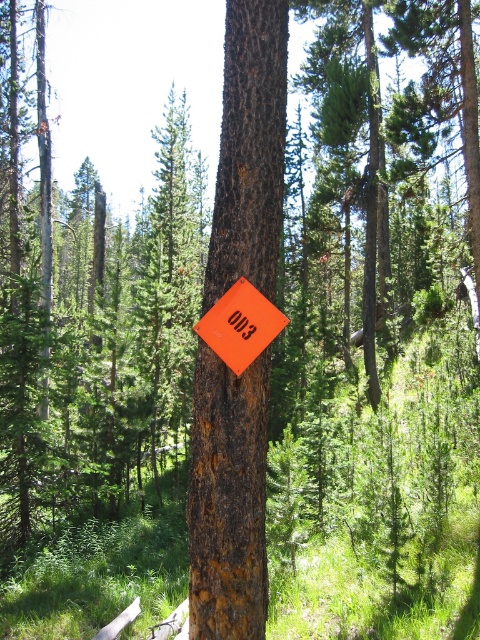
Is point (273, 141) closer to camera compared to point (238, 356)?

No, it is not.

Is point (191, 493) farther from viewer compared to point (236, 365)?

That is True.

Does point (222, 173) lie behind point (287, 321)?

That is True.

I want to click on rusty bark tree trunk at center, so click(x=228, y=499).